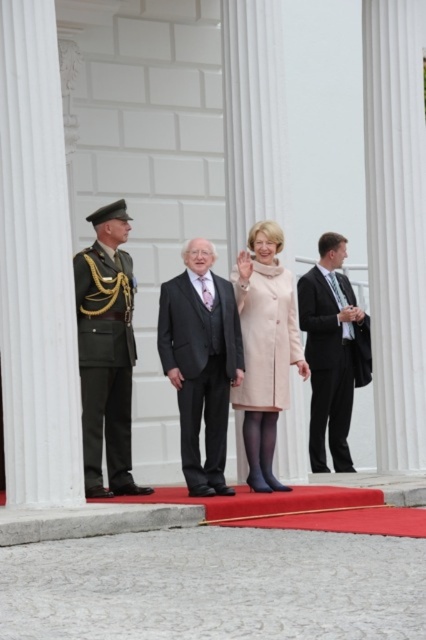
You are standing at the edge of the red carpet platform and want to walk towards the two points marked in the scene. Which point, point (103, 413) or point (275, 369), will you reach first?

You will reach point (103, 413) first because it is closer to you than point (275, 369), which is further away.

Based on the photo, you are standing on the red carpet platform in front of the white building. Where exactly is the green military uniform at left located?

The green military uniform at left is located at point 0.550 on the x axis and 0.251 on the y axis.